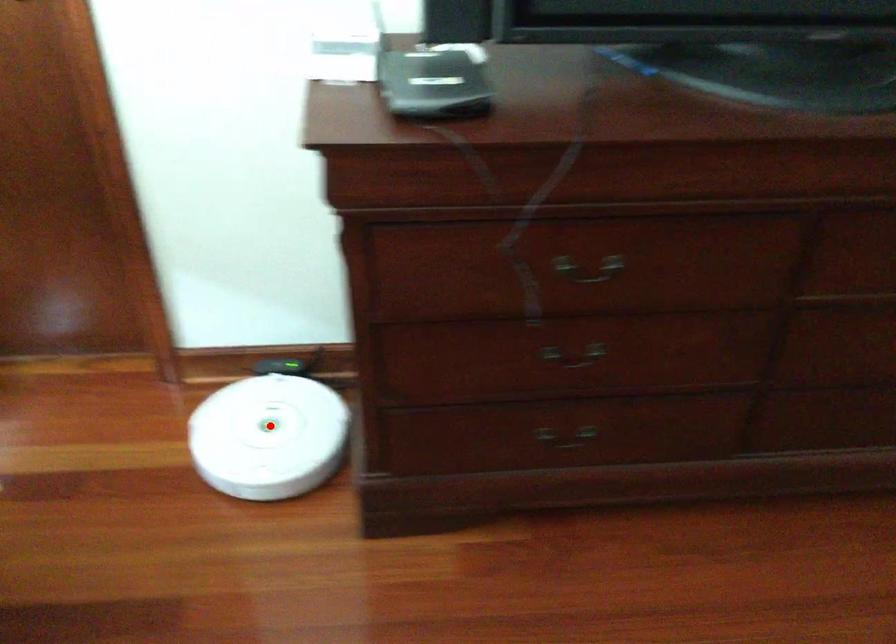
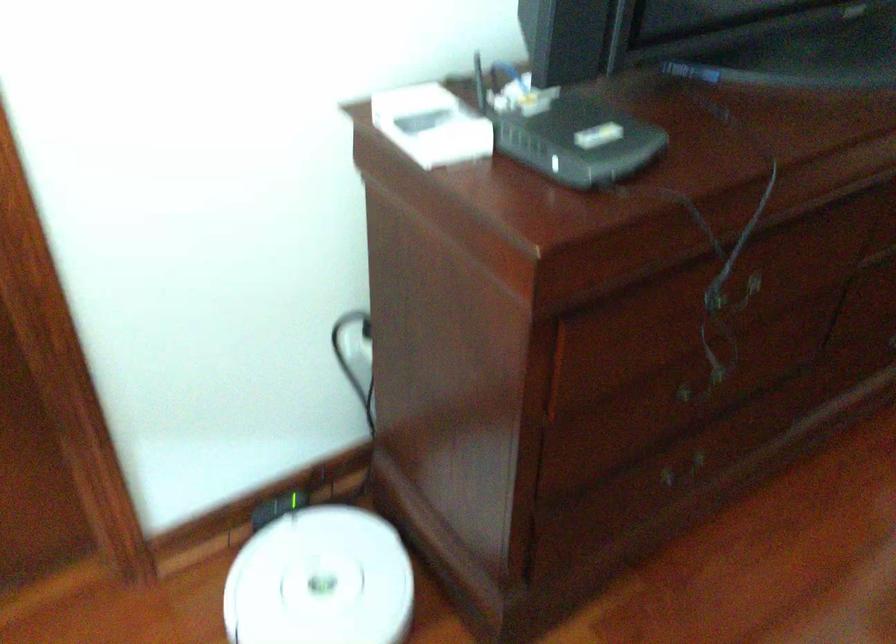
Question: I am providing you with two images of the same scene from different viewpoints. In image1, a red point is highlighted. Considering the same 3D point in image2, which of the following is correct?

Choices:
 (A) It is closer
 (B) It is farther

Answer: (A)